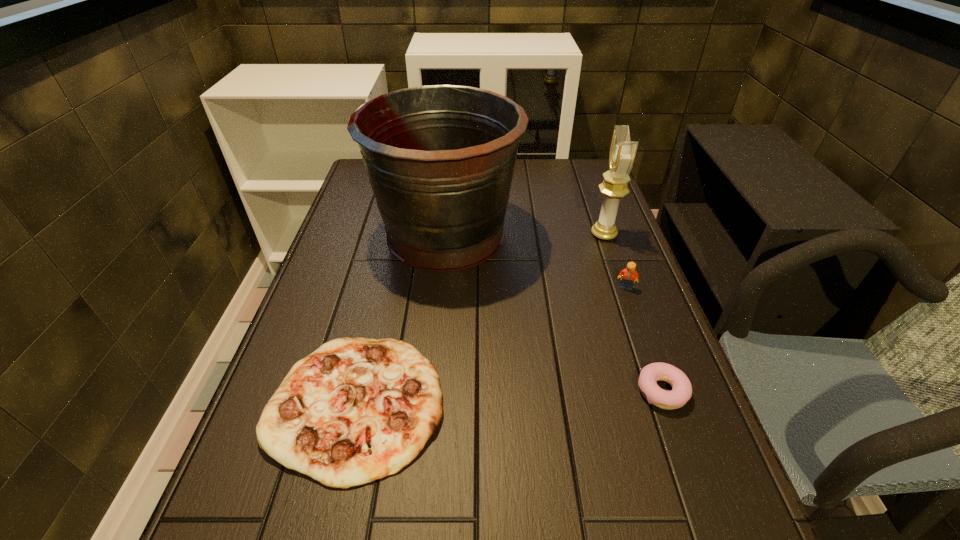
This screenshot has height=540, width=960. Find the location of `bucket`. bucket is located at coordinates (440, 159).

What are the coordinates of `award` in the screenshot? It's located at (622, 153).

Where is `the third shortest object`? the third shortest object is located at coordinates (627, 275).

Locate an element on the screen. This screenshot has height=540, width=960. pizza is located at coordinates (355, 410).

At what (x,y) coordinates should I click in order to perform the action: click on doughnut. Please return your answer as a coordinate pair (x, y). Looking at the image, I should click on pos(681,392).

Identify the location of vacant space located on the front of the bucket. (435, 346).

This screenshot has height=540, width=960. Find the location of `vacant space located 0.370m on the front-facing side of the second tallest object`. vacant space located 0.370m on the front-facing side of the second tallest object is located at coordinates (463, 234).

At what (x,y) coordinates should I click in order to perform the action: click on free region located on the front-facing side of the second tallest object. Please return your answer as a coordinate pair (x, y). The width and height of the screenshot is (960, 540). Looking at the image, I should click on (491, 234).

I want to click on vacant space located 0.170m on the front-facing side of the second tallest object, so click(532, 234).

Locate an element on the screen. vacant space located 0.160m on the front-facing side of the third shortest object is located at coordinates (645, 341).